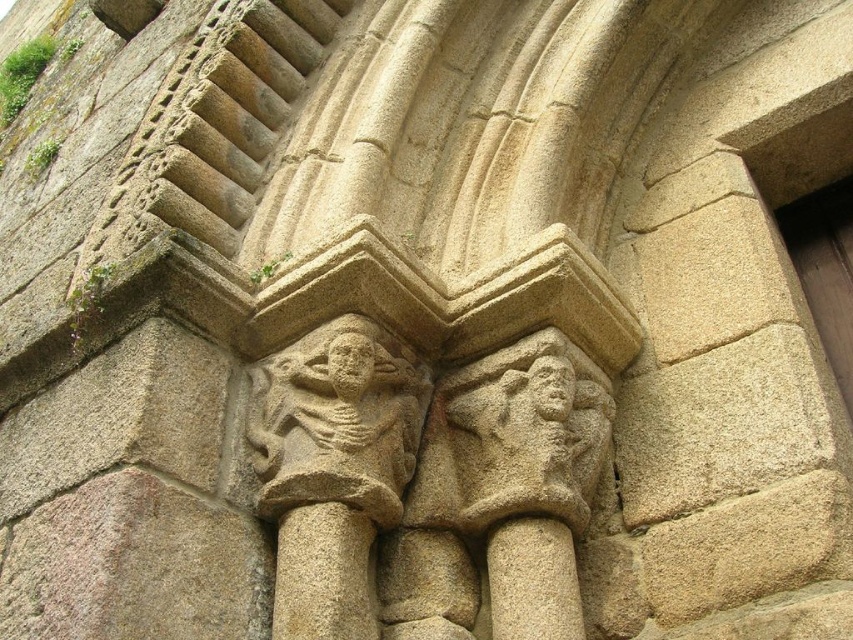
Does carved stone figure at center have a lesser width compared to light beige stone face at center?

No, carved stone figure at center is not thinner than light beige stone face at center.

Who is positioned more to the right, carved stone figure at center or light beige stone face at center?

light beige stone face at center is more to the right.

Measure the distance between point (262, 481) and camera.

The distance of point (262, 481) from camera is 2.30 meters.

Where is `carved stone figure at center`? Image resolution: width=853 pixels, height=640 pixels. carved stone figure at center is located at coordinates (331, 474).

Does light beige stone face at center have a smaller size compared to smooth stone face at center?

Indeed, light beige stone face at center has a smaller size compared to smooth stone face at center.

Between light beige stone face at center and smooth stone face at center, which one is positioned lower?

smooth stone face at center

Who is more forward, [351,369] or [560,358]?

Positioned in front is point [351,369].

You are a GUI agent. You are given a task and a screenshot of the screen. Output one action in this format:
    pyautogui.click(x=<x>, y=<y>)
    Task: Click on the light beige stone face at center
    
    Given the screenshot: What is the action you would take?
    pyautogui.click(x=350, y=364)

Does smooth stone pillar at center have a greater height compared to smooth stone face at center?

Correct, smooth stone pillar at center is much taller as smooth stone face at center.

Does smooth stone pillar at center appear on the left side of smooth stone face at center?

Correct, you'll find smooth stone pillar at center to the left of smooth stone face at center.

Locate an element on the screen. Image resolution: width=853 pixels, height=640 pixels. smooth stone pillar at center is located at coordinates (532, 580).